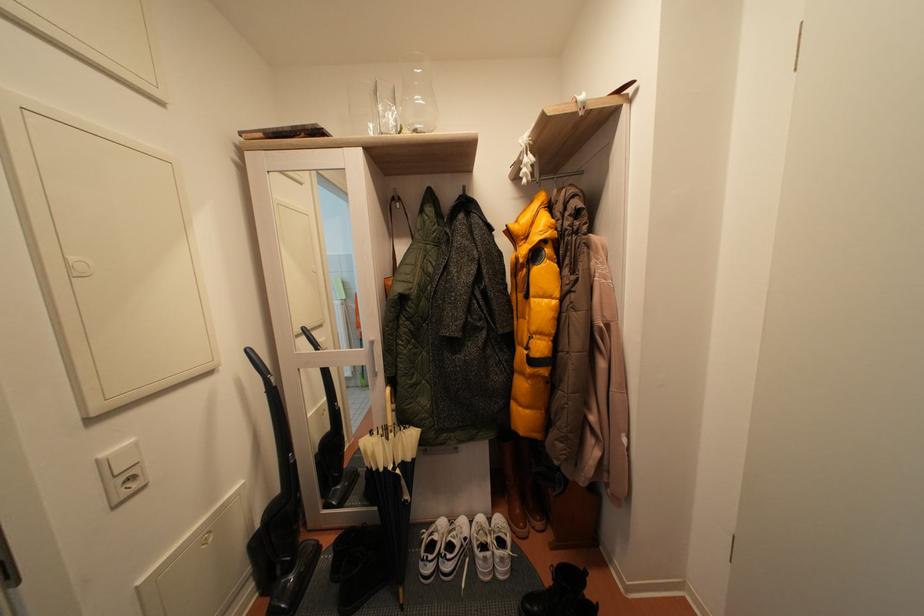
Which object does [561,594] point to?

This point indicates the black boot.